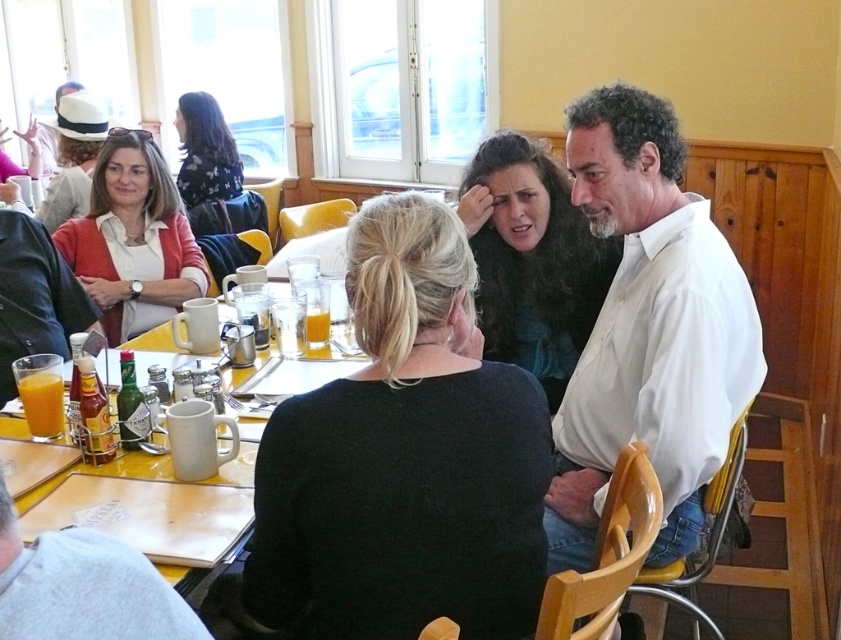
You are a customer at this cafe and you want to grab the white cotton shirt at right. The server says you can only reach items within 5 feet. Can you reach it?

The white cotton shirt at right is 5.10 feet away, which is just beyond the 5 feet limit. You cannot reach it within the allowed distance.

You are a customer at the table and want to grab both items at point (578, 541) and point (29, 388). Which item do you need to reach over first?

You need to reach over point (578, 541) first because it is closer to you than point (29, 388), which is further away.

You are sitting at the table in the image and want to reach both the point at coordinates point (556, 547) and the point at coordinates point (107, 442). Which point will you have to stretch your arm less to reach?

You will have to stretch your arm less to reach point (556, 547) because it is closer to you than point (107, 442).